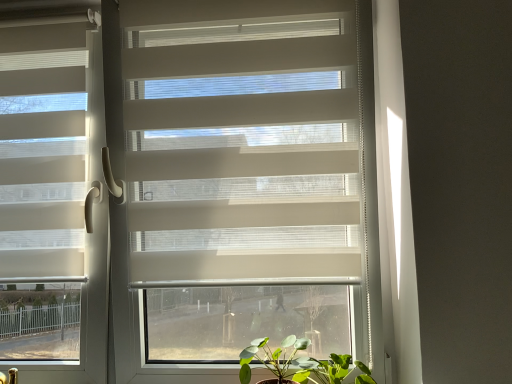
Question: Is green matte plant at lower center far from green leafy plant at lower center?

Choices:
 (A) no
 (B) yes

Answer: (A)

Question: Is green matte plant at lower center positioned beyond the bounds of green leafy plant at lower center?

Choices:
 (A) no
 (B) yes

Answer: (B)

Question: Considering the relative positions of green matte plant at lower center and green leafy plant at lower center in the image provided, is green matte plant at lower center to the right of green leafy plant at lower center from the viewer's perspective?

Choices:
 (A) no
 (B) yes

Answer: (A)

Question: Does green matte plant at lower center contain green leafy plant at lower center?

Choices:
 (A) no
 (B) yes

Answer: (A)

Question: Considering the relative sizes of green matte plant at lower center and green leafy plant at lower center in the image provided, is green matte plant at lower center taller than green leafy plant at lower center?

Choices:
 (A) no
 (B) yes

Answer: (B)

Question: Is green matte plant at lower center in front of or behind matte white blinds at left in the image?

Choices:
 (A) behind
 (B) front

Answer: (B)

Question: Is green matte plant at lower center taller or shorter than matte white blinds at left?

Choices:
 (A) short
 (B) tall

Answer: (A)

Question: Is green matte plant at lower center inside or outside of matte white blinds at left?

Choices:
 (A) outside
 (B) inside

Answer: (A)

Question: Looking at their shapes, would you say green matte plant at lower center is wider or thinner than matte white blinds at left?

Choices:
 (A) thin
 (B) wide

Answer: (B)

Question: Based on their sizes in the image, would you say matte white blinds at left is bigger or smaller than green matte plant at lower center?

Choices:
 (A) small
 (B) big

Answer: (B)

Question: From the image's perspective, is matte white blinds at left located above or below green matte plant at lower center?

Choices:
 (A) above
 (B) below

Answer: (A)

Question: From a real-world perspective, is matte white blinds at left positioned above or below green matte plant at lower center?

Choices:
 (A) above
 (B) below

Answer: (A)

Question: Visually, is matte white blinds at left positioned to the left or to the right of green matte plant at lower center?

Choices:
 (A) left
 (B) right

Answer: (A)

Question: From the image's perspective, is green matte plant at lower center located above or below green leafy plant at lower center?

Choices:
 (A) above
 (B) below

Answer: (A)

Question: Is green matte plant at lower center to the left or to the right of green leafy plant at lower center in the image?

Choices:
 (A) left
 (B) right

Answer: (A)